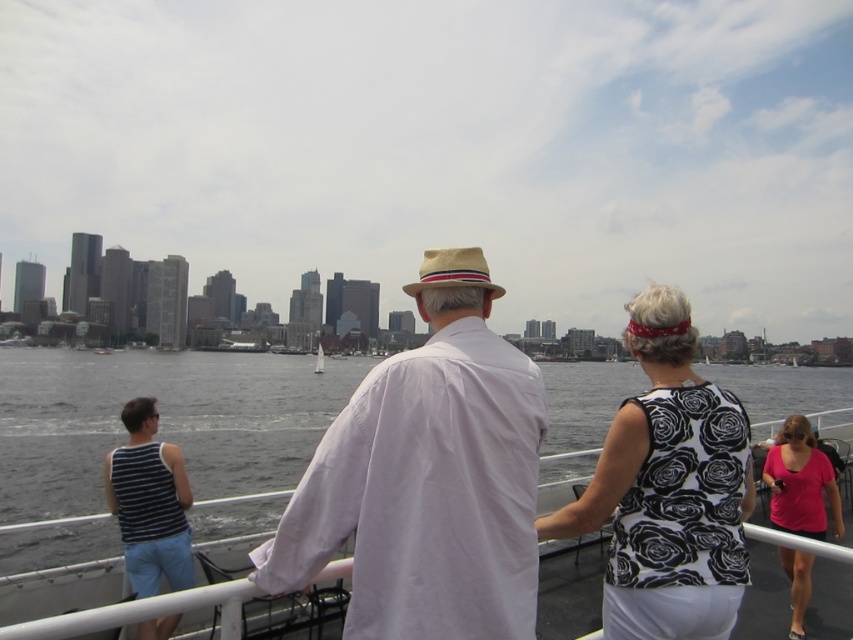
Question: Among these points, which one is farthest from the camera?

Choices:
 (A) (635, 570)
 (B) (405, 532)

Answer: (A)

Question: Is white cotton shirt at center positioned at the back of white sailboat at center?

Choices:
 (A) yes
 (B) no

Answer: (B)

Question: Estimate the real-world distances between objects in this image. Which object is farther from the white cotton shirt at center?

Choices:
 (A) black floral tank top at center
 (B) dark gray water at center
 (C) pink fabric shirt at lower right
 (D) striped cotton tank top at left

Answer: (B)

Question: Does black floral tank top at center appear on the left side of striped cotton tank top at left?

Choices:
 (A) no
 (B) yes

Answer: (A)

Question: Which object appears farthest from the camera in this image?

Choices:
 (A) dark gray water at center
 (B) pink fabric shirt at lower right

Answer: (A)

Question: Does striped cotton tank top at left have a larger size compared to pink fabric shirt at lower right?

Choices:
 (A) no
 (B) yes

Answer: (A)